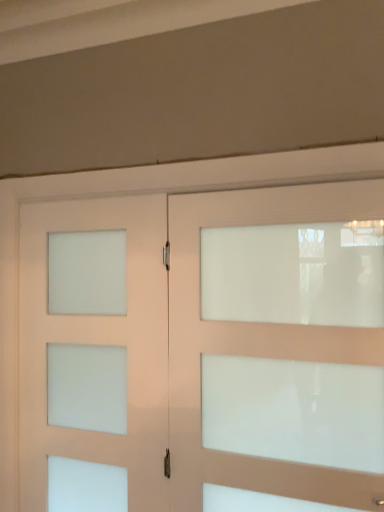
Question: Is white frosted glass door at left, the 1th door positioned from the left, looking in the opposite direction of white frosted glass door at center, which appears as the 2th door when viewed from the left?

Choices:
 (A) yes
 (B) no

Answer: (B)

Question: Is white frosted glass door at center, which appears as the 2th door when viewed from the left, a part of white frosted glass door at left, the 1th door positioned from the left?

Choices:
 (A) no
 (B) yes

Answer: (A)

Question: From a real-world perspective, does white frosted glass door at left, the 1th door positioned from the left, sit lower than white frosted glass door at center, acting as the first door starting from the right?

Choices:
 (A) no
 (B) yes

Answer: (B)

Question: Is white frosted glass door at left, which ranks as the 2th door in right-to-left order, aimed at white frosted glass door at center, acting as the first door starting from the right?

Choices:
 (A) yes
 (B) no

Answer: (B)

Question: Considering the relative positions of white frosted glass door at left, the 1th door positioned from the left, and white frosted glass door at center, which appears as the 2th door when viewed from the left, in the image provided, is white frosted glass door at left, the 1th door positioned from the left, to the right of white frosted glass door at center, which appears as the 2th door when viewed from the left, from the viewer's perspective?

Choices:
 (A) yes
 (B) no

Answer: (B)

Question: Can you confirm if white frosted glass door at left, which ranks as the 2th door in right-to-left order, is positioned to the left of white frosted glass door at center, acting as the first door starting from the right?

Choices:
 (A) no
 (B) yes

Answer: (B)

Question: From the image's perspective, is white frosted glass door at center, which appears as the 2th door when viewed from the left, beneath white frosted glass door at left, the 1th door positioned from the left?

Choices:
 (A) no
 (B) yes

Answer: (A)

Question: From a real-world perspective, is white frosted glass door at center, which appears as the 2th door when viewed from the left, located beneath white frosted glass door at left, which ranks as the 2th door in right-to-left order?

Choices:
 (A) no
 (B) yes

Answer: (A)

Question: Considering the relative sizes of white frosted glass door at center, which appears as the 2th door when viewed from the left, and white frosted glass door at left, the 1th door positioned from the left, in the image provided, is white frosted glass door at center, which appears as the 2th door when viewed from the left, thinner than white frosted glass door at left, the 1th door positioned from the left,?

Choices:
 (A) no
 (B) yes

Answer: (A)

Question: Does white frosted glass door at center, acting as the first door starting from the right, appear on the right side of white frosted glass door at left, which ranks as the 2th door in right-to-left order?

Choices:
 (A) no
 (B) yes

Answer: (B)

Question: From the image's perspective, is white frosted glass door at center, acting as the first door starting from the right, above white frosted glass door at left, the 1th door positioned from the left?

Choices:
 (A) yes
 (B) no

Answer: (A)

Question: Is white frosted glass door at center, acting as the first door starting from the right, with white frosted glass door at left, the 1th door positioned from the left?

Choices:
 (A) yes
 (B) no

Answer: (A)

Question: From a real-world perspective, is white frosted glass door at center, acting as the first door starting from the right, positioned above or below white frosted glass door at left, the 1th door positioned from the left?

Choices:
 (A) above
 (B) below

Answer: (A)